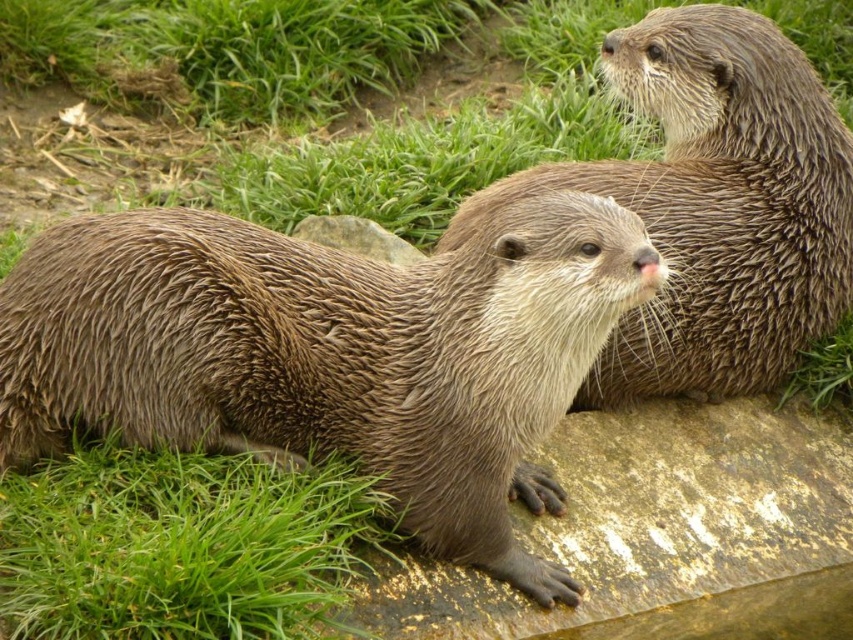
Is brown fur otter at upper right further to the viewer compared to green grass at lower left?

Yes, it is behind green grass at lower left.

Does point (692, 381) come in front of point (68, 588)?

That is False.

In order to click on brown fur otter at upper right in this screenshot , I will do `click(714, 204)`.

Which is in front, point (492, 321) or point (316, 531)?

Point (316, 531)

Is wet fur otter at center taller than green grass at lower left?

Yes, wet fur otter at center is taller than green grass at lower left.

The width and height of the screenshot is (853, 640). What are the coordinates of `wet fur otter at center` in the screenshot? It's located at (329, 355).

Which is above, wet fur otter at center or green grass at upper left?

green grass at upper left is higher up.

Can you confirm if wet fur otter at center is positioned below green grass at upper left?

Indeed, wet fur otter at center is positioned under green grass at upper left.

Who is more forward, (271, 316) or (209, 16)?

Point (271, 316)

I want to click on wet fur otter at center, so click(x=329, y=355).